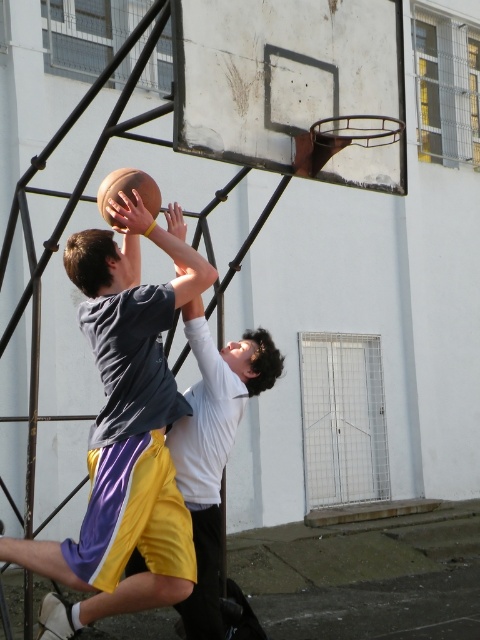
Is matte gray shirt at center to the right of rubber textured basketball at center from the viewer's perspective?

No, matte gray shirt at center is not to the right of rubber textured basketball at center.

This screenshot has height=640, width=480. Describe the element at coordinates (127, 426) in the screenshot. I see `matte gray shirt at center` at that location.

Identify the location of matte gray shirt at center. This screenshot has height=640, width=480. (127, 426).